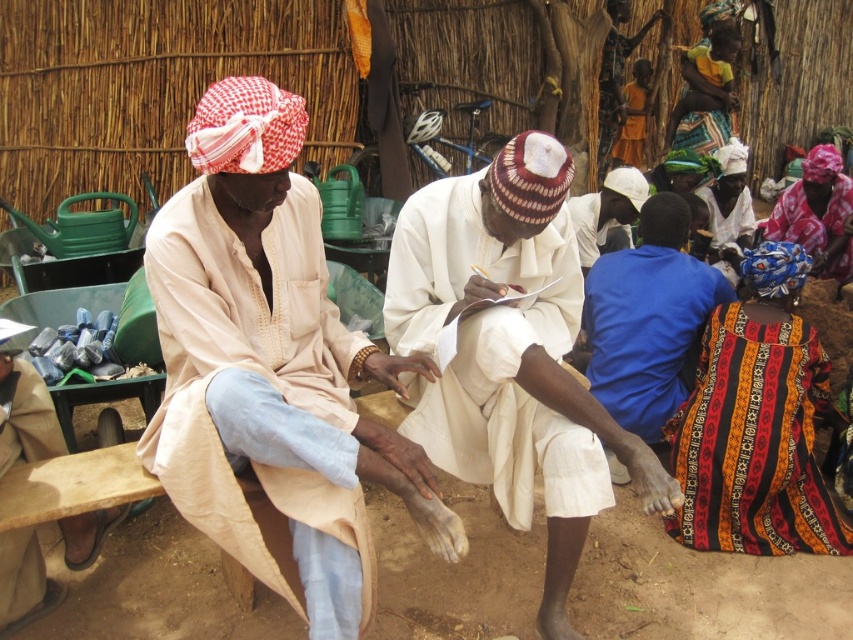
Describe the element at coordinates (271, 371) in the screenshot. I see `beige cotton robe at left` at that location.

The height and width of the screenshot is (640, 853). Identify the location of beige cotton robe at left. (271, 371).

Can you confirm if beige cotton robe at left is shorter than yellow-green woven cloth at upper right?

No, beige cotton robe at left is not shorter than yellow-green woven cloth at upper right.

Who is shorter, beige cotton robe at left or yellow-green woven cloth at upper right?

yellow-green woven cloth at upper right

Locate an element on the screen. Image resolution: width=853 pixels, height=640 pixels. beige cotton robe at left is located at coordinates (271, 371).

Is patterned fabric headscarf at upper right to the left of yellow-green woven cloth at upper right from the viewer's perspective?

Correct, you'll find patterned fabric headscarf at upper right to the left of yellow-green woven cloth at upper right.

Between point (801, 170) and point (722, 120), which one is positioned in front?

Positioned in front is point (722, 120).

Measure the distance between patterned fabric headscarf at upper right and camera.

patterned fabric headscarf at upper right and camera are 18.04 feet apart from each other.

Locate an element on the screen. The height and width of the screenshot is (640, 853). patterned fabric headscarf at upper right is located at coordinates (817, 214).